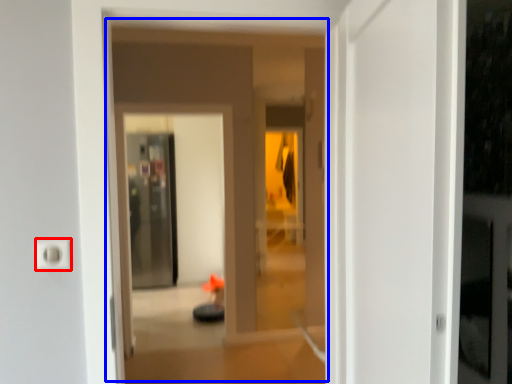
Question: Which object appears closest to the camera in this image, electric outlet (highlighted by a red box) or hotel lobby (highlighted by a blue box)?

Choices:
 (A) electric outlet
 (B) hotel lobby

Answer: (B)